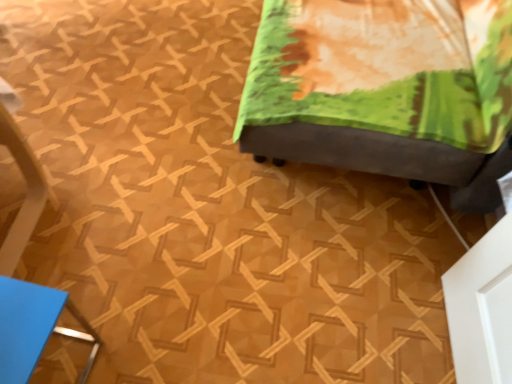
Question: Is point (269, 33) closer or farther from the camera than point (25, 336)?

Choices:
 (A) farther
 (B) closer

Answer: (A)

Question: Is velvet green ottoman at center, the first furniture in the top-to-bottom sequence, in front of or behind blue matte folder at lower left, the 1th furniture when ordered from left to right, in the image?

Choices:
 (A) behind
 (B) front

Answer: (A)

Question: From the image's perspective, is velvet green ottoman at center, which appears as the first furniture when viewed from the right, above or below blue matte folder at lower left, the 1th furniture when ordered from left to right?

Choices:
 (A) below
 (B) above

Answer: (B)

Question: Is blue matte folder at lower left, marked as the first furniture in a bottom-to-top arrangement, inside the boundaries of velvet green ottoman at center, which appears as the second furniture when viewed from the left, or outside?

Choices:
 (A) outside
 (B) inside

Answer: (A)

Question: From the image's perspective, relative to velvet green ottoman at center, which appears as the second furniture when viewed from the left, is blue matte folder at lower left, marked as the first furniture in a bottom-to-top arrangement, above or below?

Choices:
 (A) below
 (B) above

Answer: (A)

Question: From a real-world perspective, relative to velvet green ottoman at center, the first furniture in the top-to-bottom sequence, is blue matte folder at lower left, the 2th furniture in the top-to-bottom sequence, vertically above or below?

Choices:
 (A) above
 (B) below

Answer: (B)

Question: In terms of height, does blue matte folder at lower left, positioned as the 2th furniture in right-to-left order, look taller or shorter compared to velvet green ottoman at center, which appears as the first furniture when viewed from the right?

Choices:
 (A) tall
 (B) short

Answer: (B)